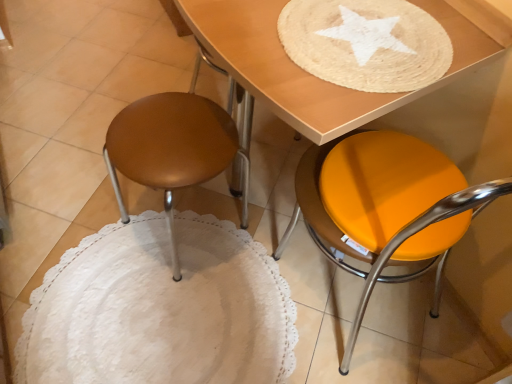
In order to click on blank space to the left of matte brown stool at left in this screenshot , I will do `click(82, 228)`.